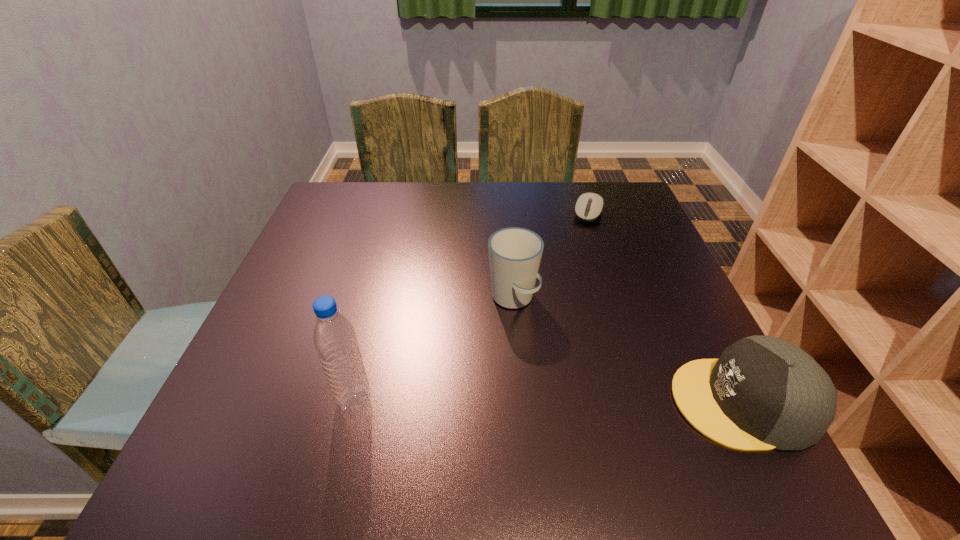
Find the location of `object that is the third nearest to the farthest object`. object that is the third nearest to the farthest object is located at coordinates (334, 338).

Identify which object is located as the nearest to the computer equipment. Please provide its 2D coordinates. Your answer should be formatted as a tuple, i.e. [(x, y)], where the tuple contains the x and y coordinates of a point satisfying the conditions above.

[(515, 253)]

Find the location of a particular element. This screenshot has height=540, width=960. vacant region that satisfies the following two spatial constraints: 1. on the front side of the farthest object; 2. on the front-facing side of the third tallest object is located at coordinates (652, 402).

Find the location of a particular element. This screenshot has width=960, height=540. vacant space that satisfies the following two spatial constraints: 1. on the front side of the cap; 2. on the front-facing side of the shortest object is located at coordinates (652, 402).

Identify the location of free space that satisfies the following two spatial constraints: 1. on the front side of the tallest object; 2. on the front-facing side of the cap. (354, 402).

Locate an element on the screen. This screenshot has width=960, height=540. vacant space that satisfies the following two spatial constraints: 1. on the front side of the cap; 2. on the front-facing side of the second object from left to right is located at coordinates (521, 402).

The image size is (960, 540). Identify the location of free space that satisfies the following two spatial constraints: 1. on the back side of the farthest object; 2. on the right side of the leftmost object. click(x=400, y=213).